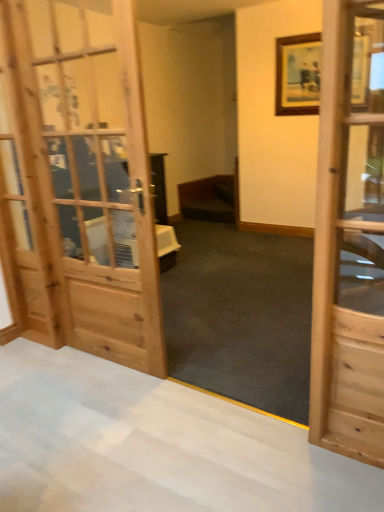
Question: From the image's perspective, is wooden door at right below dark wood bed at center?

Choices:
 (A) no
 (B) yes

Answer: (B)

Question: Can you confirm if wooden door at right is positioned to the right of dark wood bed at center?

Choices:
 (A) no
 (B) yes

Answer: (B)

Question: Would you say wooden door at right contains dark wood bed at center?

Choices:
 (A) no
 (B) yes

Answer: (A)

Question: Is wooden door at right not inside dark wood bed at center?

Choices:
 (A) yes
 (B) no

Answer: (A)

Question: Is wooden door at right facing towards dark wood bed at center?

Choices:
 (A) yes
 (B) no

Answer: (B)

Question: From a real-world perspective, is wooden door at right below dark wood bed at center?

Choices:
 (A) no
 (B) yes

Answer: (A)

Question: Is dark wood bed at center positioned before wooden door at right?

Choices:
 (A) no
 (B) yes

Answer: (A)

Question: Does dark wood bed at center have a lesser width compared to wooden door at right?

Choices:
 (A) no
 (B) yes

Answer: (A)

Question: Considering the relative sizes of dark wood bed at center and wooden door at right in the image provided, is dark wood bed at center wider than wooden door at right?

Choices:
 (A) yes
 (B) no

Answer: (A)

Question: Can we say dark wood bed at center lies outside wooden door at right?

Choices:
 (A) no
 (B) yes

Answer: (B)

Question: Is dark wood bed at center shorter than wooden door at right?

Choices:
 (A) no
 (B) yes

Answer: (B)

Question: Is dark wood bed at center oriented towards wooden door at right?

Choices:
 (A) yes
 (B) no

Answer: (B)

Question: Which is correct: wooden door at right is inside dark wood bed at center, or outside of it?

Choices:
 (A) inside
 (B) outside

Answer: (B)